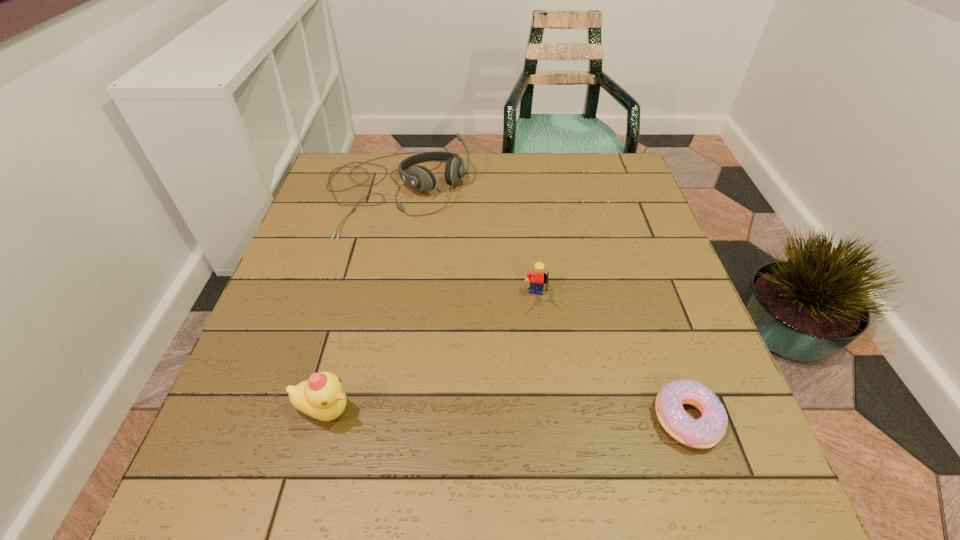
Where is `free space that satisfies the following two spatial constraints: 1. on the front side of the farthest object; 2. on the right side of the rightmost object`? free space that satisfies the following two spatial constraints: 1. on the front side of the farthest object; 2. on the right side of the rightmost object is located at coordinates pyautogui.click(x=346, y=418).